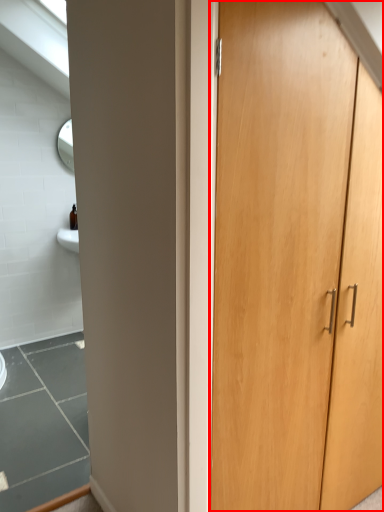
Question: From the image's perspective, where is cupboard (annotated by the red box) located relative to window?

Choices:
 (A) above
 (B) below

Answer: (B)